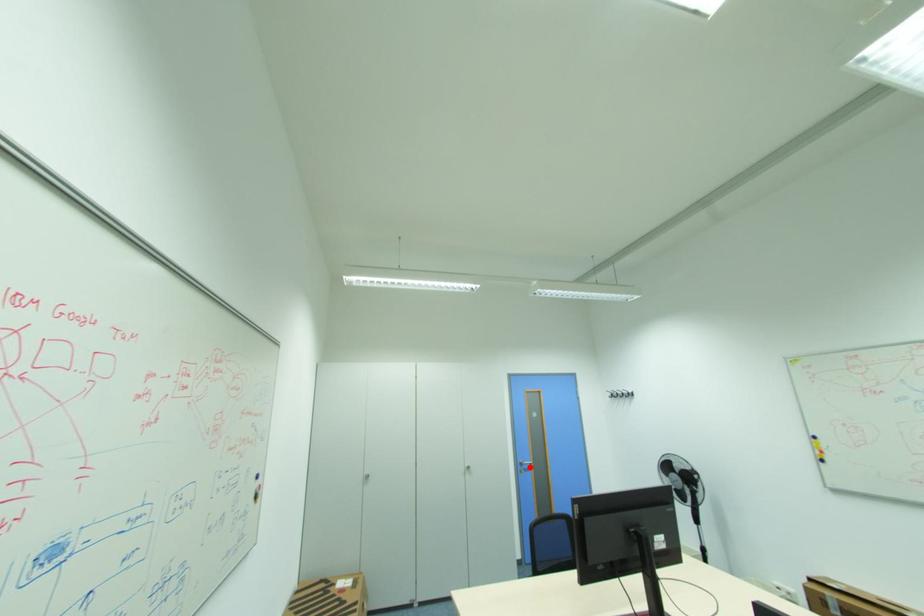
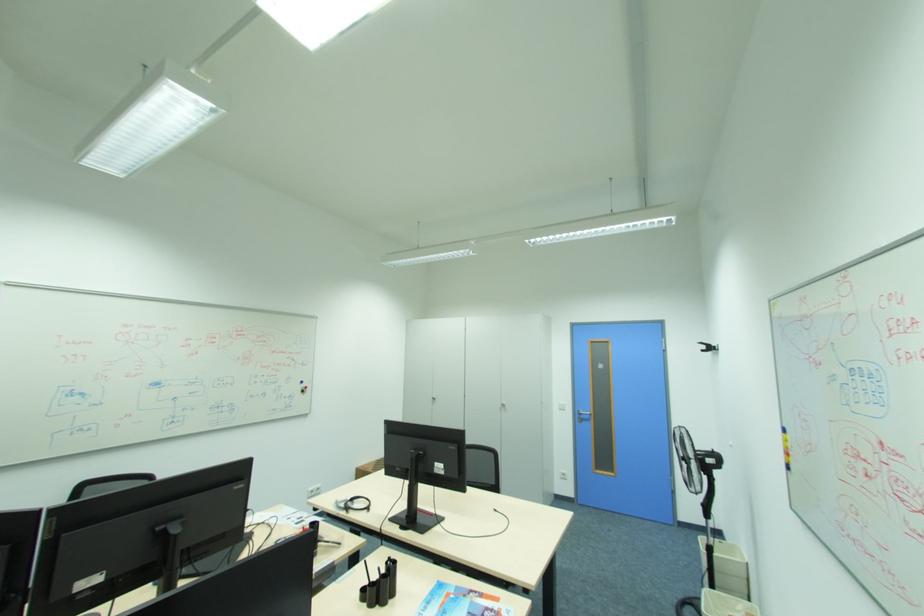
Locate, in the second image, the point that corresponds to the highlighted location in the first image.

(588, 416)